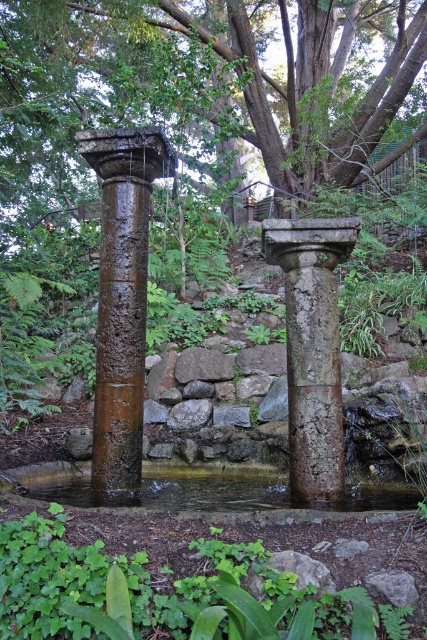
Question: Which object appears closest to the camera in this image?

Choices:
 (A) rusty stone column at center
 (B) green leafy plant at lower center

Answer: (B)

Question: Among these objects, which one is farthest from the camera?

Choices:
 (A) rusty stone column at left
 (B) rusty stone column at center
 (C) clear water at center

Answer: (A)

Question: Observing the image, what is the correct spatial positioning of green leafy tree at center in reference to green leafy plant at lower center?

Choices:
 (A) below
 (B) above

Answer: (B)

Question: Can you confirm if green leafy tree at center is positioned above rusty stone column at center?

Choices:
 (A) yes
 (B) no

Answer: (A)

Question: In this image, where is green leafy tree at center located relative to green leafy plant at lower center?

Choices:
 (A) below
 (B) above

Answer: (B)

Question: Which object appears closest to the camera in this image?

Choices:
 (A) clear water at center
 (B) rusty stone column at left

Answer: (A)